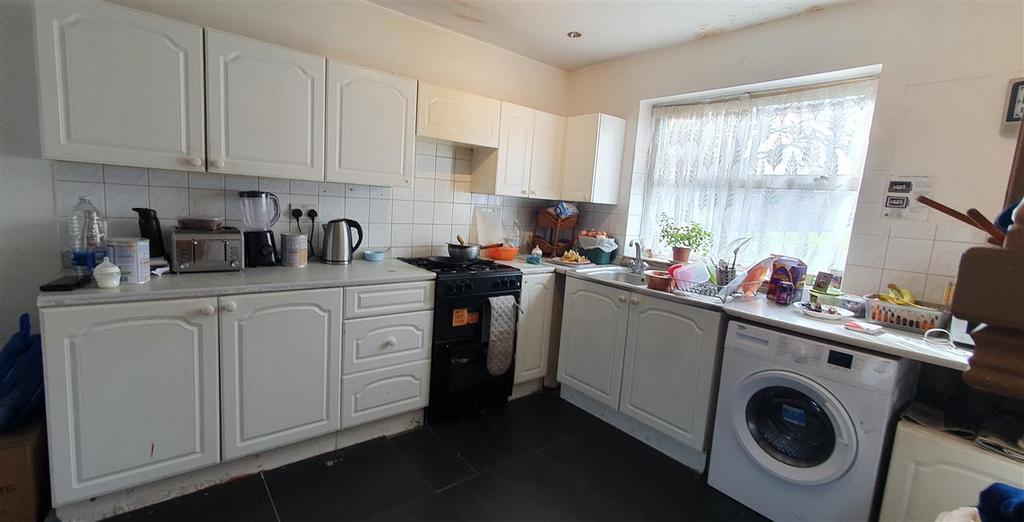
The width and height of the screenshot is (1024, 522). In order to click on backsplash tiles in this screenshot , I will do `click(438, 219)`, `click(868, 258)`.